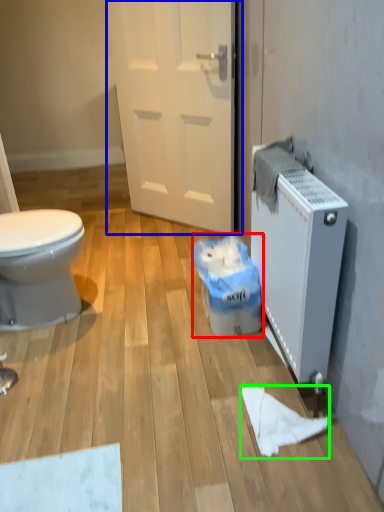
Question: Which object is the farthest from garbage (highlighted by a red box)? Choose among these: door (highlighted by a blue box) or toilet paper (highlighted by a green box).

Choices:
 (A) door
 (B) toilet paper

Answer: (A)